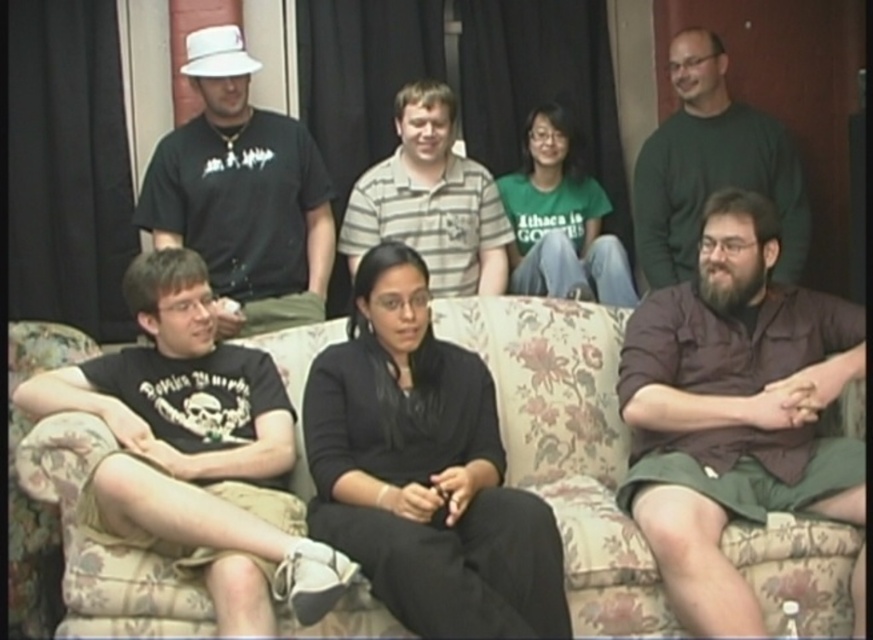
Which is above, black cotton t-shirt at left or striped cotton shirt at center?

striped cotton shirt at center

Is black cotton t-shirt at left below striped cotton shirt at center?

Indeed, black cotton t-shirt at left is positioned under striped cotton shirt at center.

This screenshot has height=640, width=873. I want to click on black cotton t-shirt at left, so click(196, 451).

Which is more to the left, floral fabric couch at center or brown cotton shirt at center?

floral fabric couch at center

You are a GUI agent. You are given a task and a screenshot of the screen. Output one action in this format:
    pyautogui.click(x=<x>, y=<y>)
    Task: Click on the floral fabric couch at center
    Image resolution: width=873 pixels, height=640 pixels.
    Given the screenshot: What is the action you would take?
    pyautogui.click(x=567, y=444)

Is point (801, 525) farther from viewer compared to point (810, 326)?

No, (801, 525) is in front of (810, 326).

Identify the location of floral fabric couch at center. This screenshot has width=873, height=640. (567, 444).

Between brown cotton shirt at center and striped cotton shirt at center, which one is positioned lower?

brown cotton shirt at center is below.

Is brown cotton shirt at center positioned behind striped cotton shirt at center?

No, brown cotton shirt at center is closer to the viewer.

This screenshot has height=640, width=873. I want to click on brown cotton shirt at center, so click(733, 410).